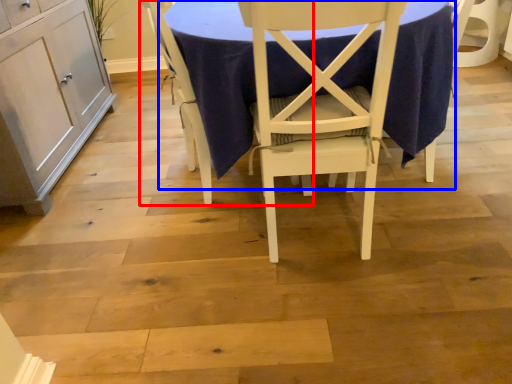
Question: Among these objects, which one is nearest to the camera, chair (highlighted by a red box) or table (highlighted by a blue box)?

Choices:
 (A) chair
 (B) table

Answer: (B)